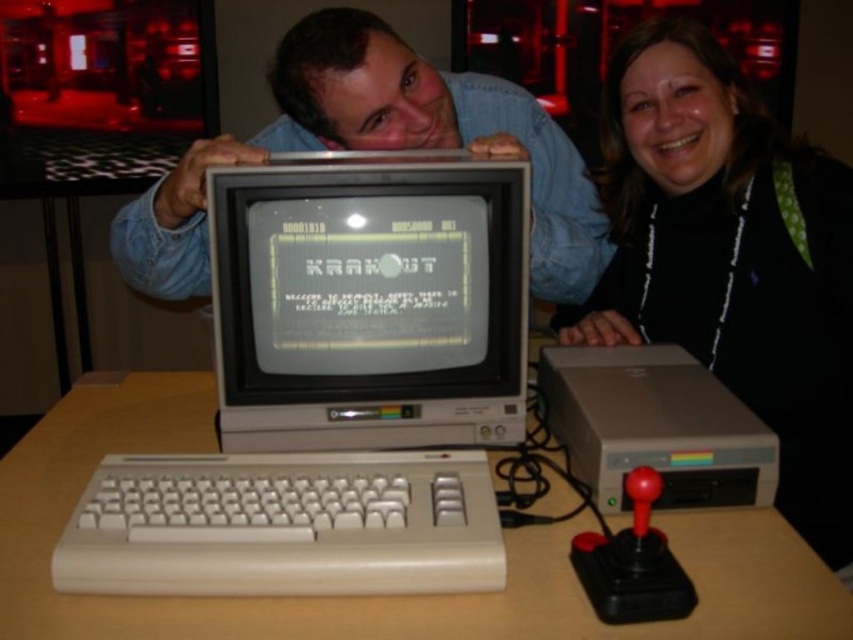
Question: Can you confirm if black matte jacket at center is positioned to the left of matte gray desktop computer at lower right?

Choices:
 (A) no
 (B) yes

Answer: (A)

Question: Which point is farther from the camera taking this photo?

Choices:
 (A) (184, 186)
 (B) (474, 314)

Answer: (B)

Question: Does white plastic computer at center have a larger size compared to wooden table at center?

Choices:
 (A) no
 (B) yes

Answer: (A)

Question: Considering the real-world distances, which object is farthest from the white plastic computer at center?

Choices:
 (A) matte gray desktop computer at lower right
 (B) black matte jacket at center
 (C) matte gray monitor at center
 (D) silver metallic monitor at center

Answer: (B)

Question: Can you confirm if wooden table at center is thinner than matte gray desktop computer at lower right?

Choices:
 (A) no
 (B) yes

Answer: (A)

Question: Among these objects, which one is nearest to the camera?

Choices:
 (A) white plastic keyboard at lower center
 (B) matte gray monitor at center

Answer: (A)